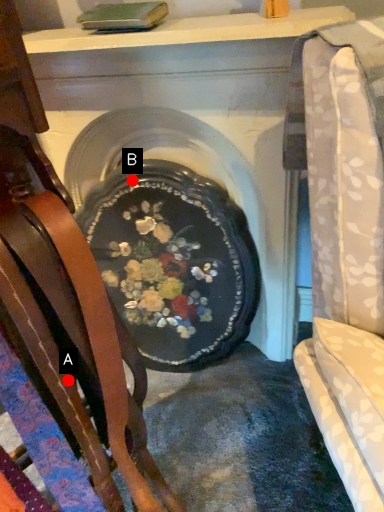
Question: Two points are circled on the image, labeled by A and B beside each circle. Among these points, which one is nearest to the camera?

Choices:
 (A) A is closer
 (B) B is closer

Answer: (A)